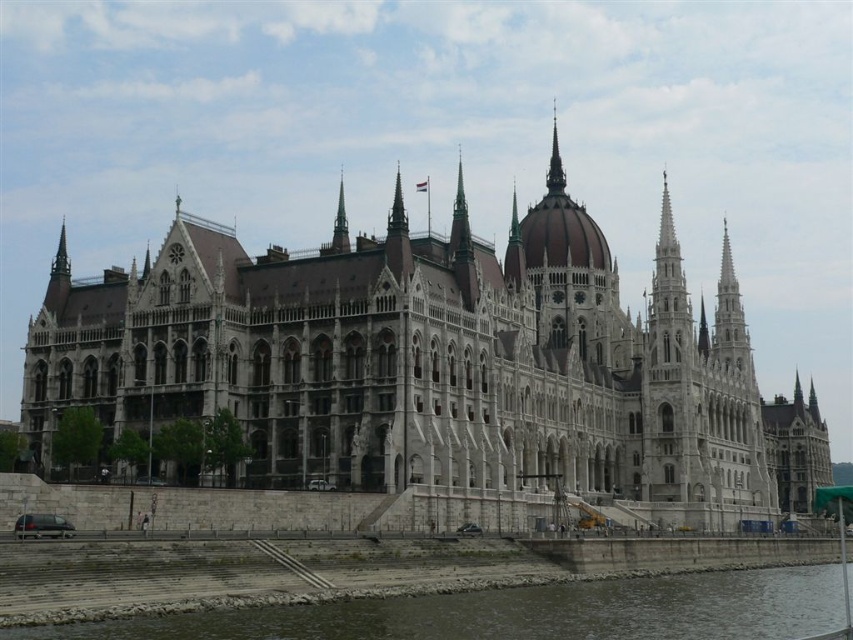
Question: Can you confirm if gray rocky river at lower left is positioned to the left of white stone tower at center?

Choices:
 (A) yes
 (B) no

Answer: (A)

Question: Which object appears closest to the camera in this image?

Choices:
 (A) white stone tower at center
 (B) white stone palace at center
 (C) polished silver spire at upper center
 (D) gray rocky river at lower left

Answer: (D)

Question: Considering the relative positions of white stone palace at center and white stone tower at center in the image provided, where is white stone palace at center located with respect to white stone tower at center?

Choices:
 (A) above
 (B) below

Answer: (A)

Question: Considering the real-world distances, which object is closest to the smooth gray spire at center?

Choices:
 (A) gray rocky river at lower left
 (B) white stone tower at center
 (C) white stone palace at center

Answer: (C)

Question: Which point is closer to the camera?

Choices:
 (A) (643, 413)
 (B) (556, 170)

Answer: (A)

Question: Can you confirm if white stone tower at center is smaller than smooth gray spire at center?

Choices:
 (A) no
 (B) yes

Answer: (B)